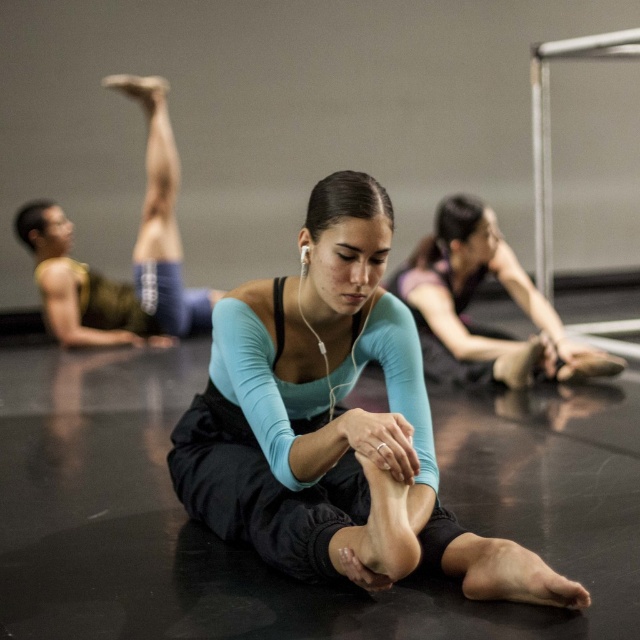
Between point (48, 221) and point (616, 365), which one is positioned behind?

Positioned behind is point (48, 221).

Is matte blue tights at upper left closer to camera compared to matte blue leggings at center?

No, matte blue tights at upper left is further to the viewer.

Measure the distance between point (168,116) and camera.

Point (168,116) is 17.52 feet from camera.

At what (x,y) coordinates should I click in order to perform the action: click on matte blue tights at upper left. Please return your answer as a coordinate pair (x, y). Looking at the image, I should click on (132, 253).

In the scene shown: Is teal matte leggings at center taller than matte blue tights at upper left?

In fact, teal matte leggings at center may be shorter than matte blue tights at upper left.

Can you confirm if teal matte leggings at center is wider than matte blue tights at upper left?

Incorrect, teal matte leggings at center's width does not surpass matte blue tights at upper left's.

At what (x,y) coordinates should I click in order to perform the action: click on teal matte leggings at center. Please return your answer as a coordinate pair (x, y). The height and width of the screenshot is (640, 640). Looking at the image, I should click on (333, 424).

Where is `teal matte leggings at center`? The width and height of the screenshot is (640, 640). teal matte leggings at center is located at coordinates (333, 424).

Can you confirm if teal matte leggings at center is positioned below matte blue leggings at center?

Correct, teal matte leggings at center is located below matte blue leggings at center.

Between teal matte leggings at center and matte blue leggings at center, which one has less height?

With less height is matte blue leggings at center.

Is point (298, 449) positioned before point (529, 353)?

Yes, it is.

Locate an element on the screen. The image size is (640, 640). teal matte leggings at center is located at coordinates (333, 424).